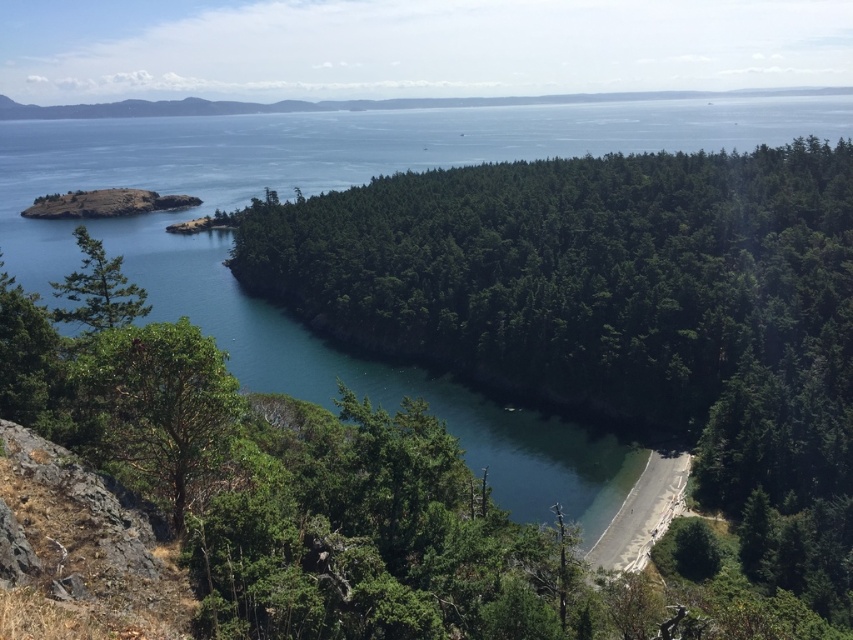
Who is higher up, green leafy tree at center or smooth sand beach at lower center?

green leafy tree at center is above.

Does green leafy tree at center appear on the left side of smooth sand beach at lower center?

In fact, green leafy tree at center is to the right of smooth sand beach at lower center.

Does point (734, 396) lie behind point (641, 490)?

Yes, point (734, 396) is behind point (641, 490).

This screenshot has height=640, width=853. In order to click on green leafy tree at center in this screenshot , I will do `click(619, 314)`.

Which is below, green rough bark tree at lower left or smooth sand beach at lower center?

smooth sand beach at lower center is lower down.

Identify the location of green rough bark tree at lower left. [x=157, y=406].

Image resolution: width=853 pixels, height=640 pixels. Identify the location of green rough bark tree at lower left. (157, 406).

Is green rough bark tree at lower left positioned at the back of green matte tree at left?

No, it is in front of green matte tree at left.

Is green rough bark tree at lower left above green matte tree at left?

Incorrect, green rough bark tree at lower left is not positioned above green matte tree at left.

Between point (143, 449) and point (97, 310), which one is positioned in front?

Point (143, 449) is in front.

At what (x,y) coordinates should I click in order to perform the action: click on green rough bark tree at lower left. Please return your answer as a coordinate pair (x, y). Looking at the image, I should click on (157, 406).